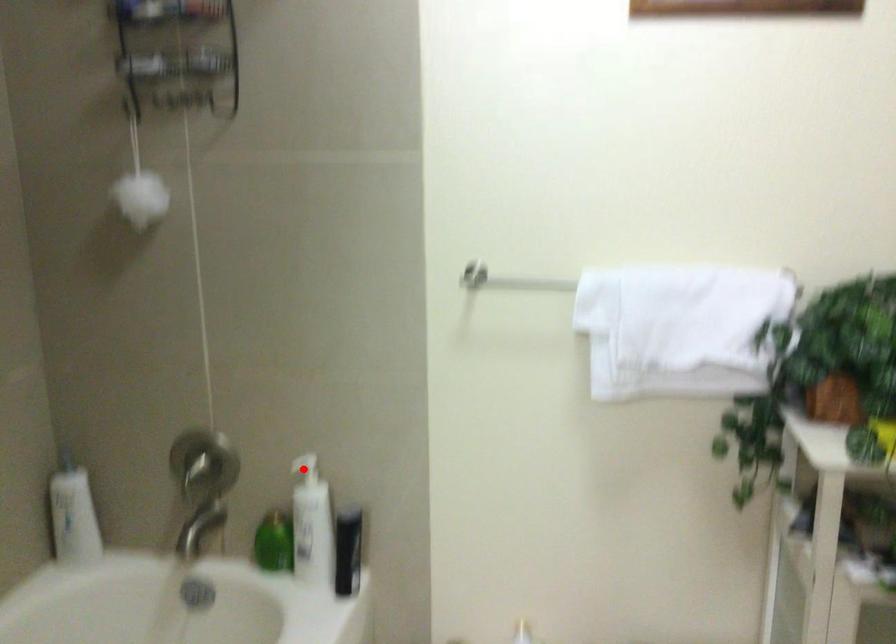
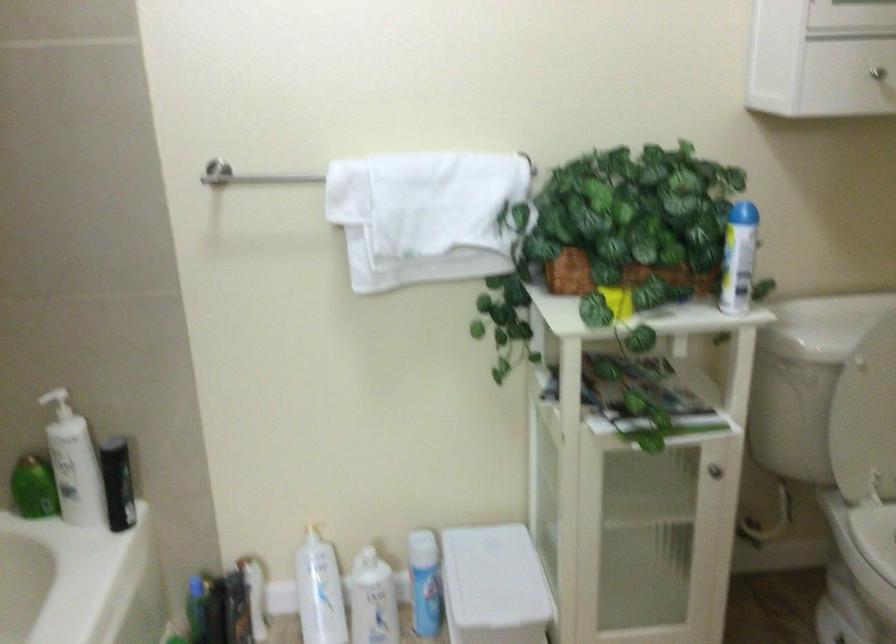
Find the pixel in the second image that matches the highlighted location in the first image.

(56, 402)